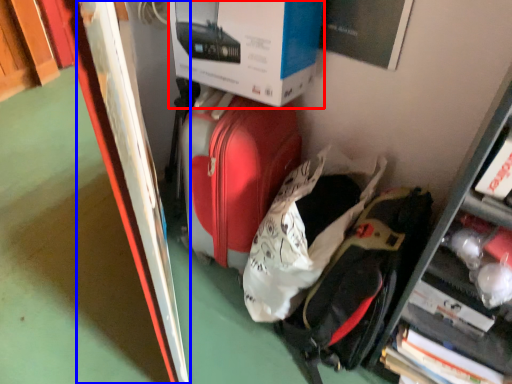
Question: Which point is closer to the camera, box (highlighted by a red box) or bulletin board (highlighted by a blue box)?

Choices:
 (A) box
 (B) bulletin board

Answer: (B)